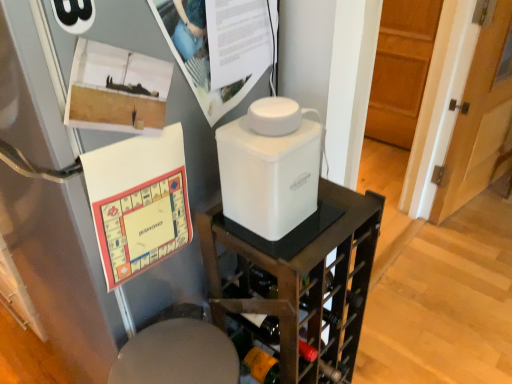
Question: Does white plastic container at center have a greater width compared to wooden door at right?

Choices:
 (A) yes
 (B) no

Answer: (A)

Question: Can you confirm if white plastic container at center is taller than wooden door at right?

Choices:
 (A) yes
 (B) no

Answer: (B)

Question: Is white plastic container at center to the left of wooden door at right from the viewer's perspective?

Choices:
 (A) no
 (B) yes

Answer: (B)

Question: Does white plastic container at center have a lesser width compared to wooden door at right?

Choices:
 (A) no
 (B) yes

Answer: (A)

Question: Is white plastic container at center not close to wooden door at right?

Choices:
 (A) yes
 (B) no

Answer: (A)

Question: Is the position of white plastic container at center more distant than that of wooden door at right?

Choices:
 (A) no
 (B) yes

Answer: (A)

Question: From the image's perspective, is wooden door at right located beneath white plastic container at center?

Choices:
 (A) no
 (B) yes

Answer: (A)

Question: Considering the relative sizes of wooden door at right and white plastic container at center in the image provided, is wooden door at right bigger than white plastic container at center?

Choices:
 (A) no
 (B) yes

Answer: (A)

Question: Is white plastic container at center at the back of wooden door at right?

Choices:
 (A) no
 (B) yes

Answer: (A)

Question: Is wooden door at right taller than white plastic container at center?

Choices:
 (A) yes
 (B) no

Answer: (A)

Question: From a real-world perspective, is wooden door at right beneath white plastic container at center?

Choices:
 (A) no
 (B) yes

Answer: (A)

Question: Does wooden door at right have a greater width compared to white plastic container at center?

Choices:
 (A) yes
 (B) no

Answer: (B)

Question: Does wooden door at right have a lesser width compared to white plastic container at center?

Choices:
 (A) yes
 (B) no

Answer: (A)